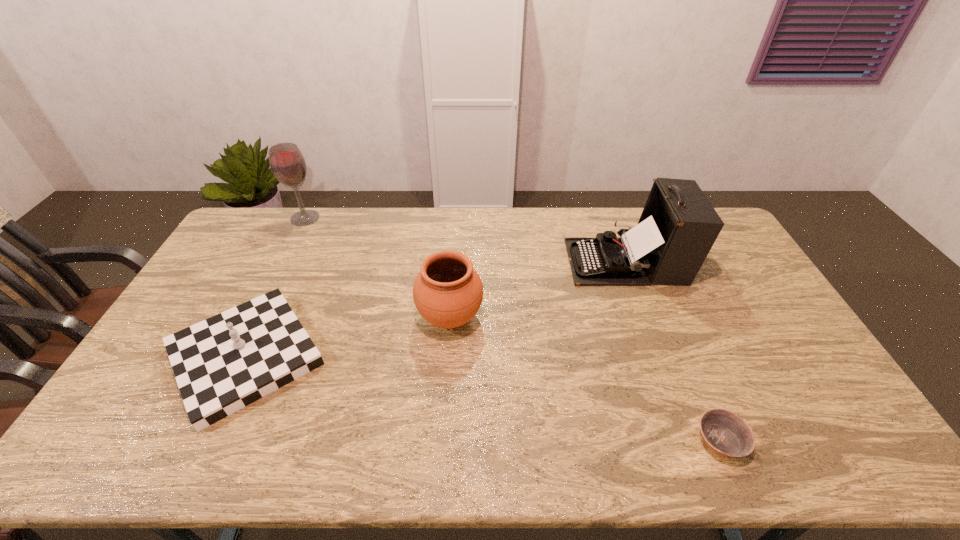
Locate an element on the screen. This screenshot has width=960, height=540. alcohol is located at coordinates (287, 163).

This screenshot has height=540, width=960. Find the location of `typewriter`. typewriter is located at coordinates (x=678, y=226).

Locate an element on the screen. pottery is located at coordinates (448, 292).

You are a GUI agent. You are given a task and a screenshot of the screen. Output one action in this format:
    pyautogui.click(x=<x>, y=<y>)
    Task: Click on the third shortest object
    Image resolution: width=960 pixels, height=540 pixels.
    Given the screenshot: What is the action you would take?
    pyautogui.click(x=448, y=292)

In order to click on checkerboard in this screenshot , I will do `click(222, 364)`.

Locate an element on the screen. Image resolution: width=960 pixels, height=540 pixels. bowl is located at coordinates (723, 431).

Locate an element on the screen. This screenshot has width=960, height=540. free space located on the front of the alcohol is located at coordinates (292, 245).

Locate an element on the screen. The height and width of the screenshot is (540, 960). vacant space located inside the open case of the second farthest object is located at coordinates (525, 261).

Locate an element on the screen. This screenshot has width=960, height=540. vacant region located inside the open case of the second farthest object is located at coordinates (545, 261).

The image size is (960, 540). In order to click on vacant area situated inside the open case of the second farthest object in this screenshot , I will do `click(548, 261)`.